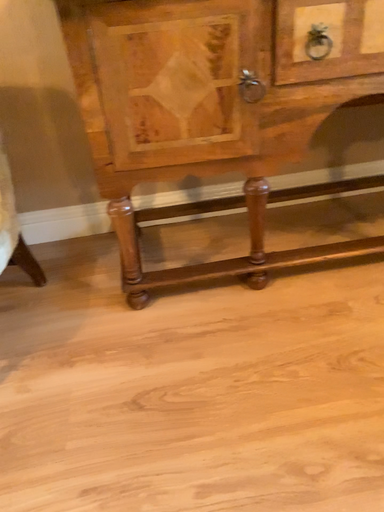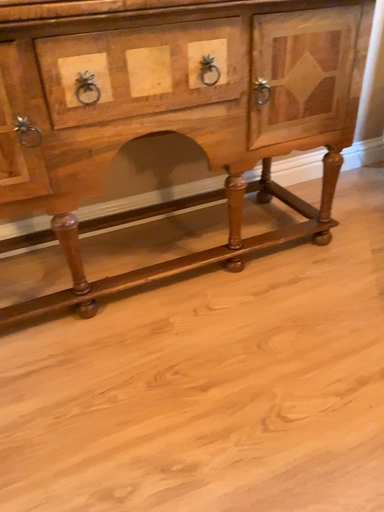
Question: Which way did the camera rotate in the video?

Choices:
 (A) rotated left
 (B) rotated right

Answer: (B)